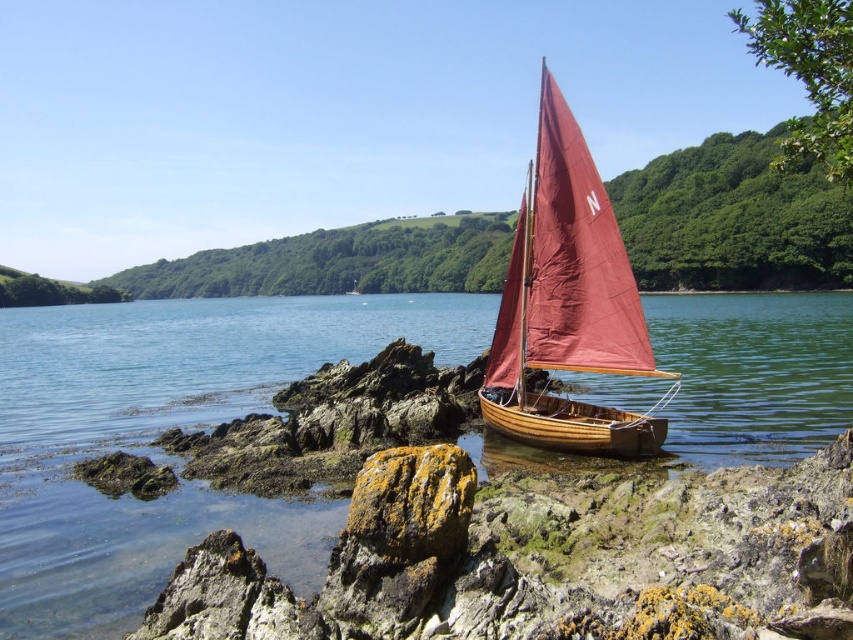
Can you confirm if clear water at boat right is wider than wooden sailboat at center?

Correct, the width of clear water at boat right exceeds that of wooden sailboat at center.

Looking at this image, is clear water at boat right to the right of wooden sailboat at center from the viewer's perspective?

Incorrect, clear water at boat right is not on the right side of wooden sailboat at center.

You are a GUI agent. You are given a task and a screenshot of the screen. Output one action in this format:
    pyautogui.click(x=<x>, y=<y>)
    Task: Click on the clear water at boat right
    The image size is (853, 640).
    Given the screenshot: What is the action you would take?
    pyautogui.click(x=161, y=426)